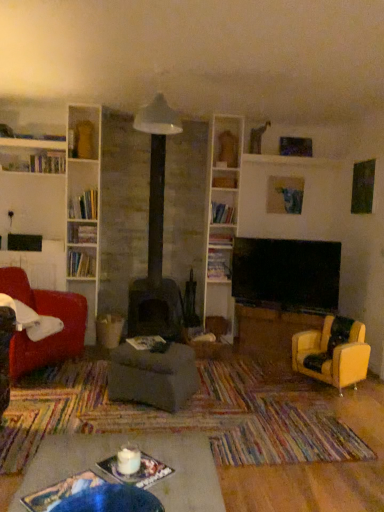
Where is `free space to the left of dark gray fabric footrest at center`? The width and height of the screenshot is (384, 512). free space to the left of dark gray fabric footrest at center is located at coordinates (85, 397).